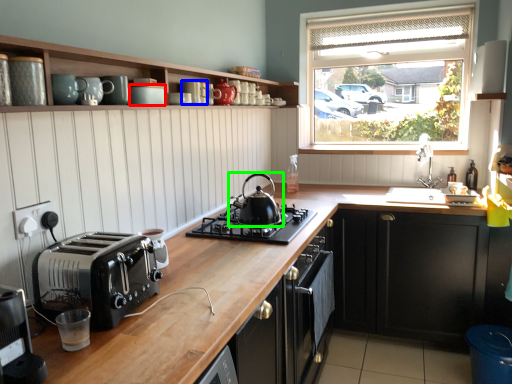
Question: Which object is the farthest from appliance (highlighted by a red box)? Choose among these: appliance (highlighted by a blue box) or kitchen appliance (highlighted by a green box).

Choices:
 (A) appliance
 (B) kitchen appliance

Answer: (B)